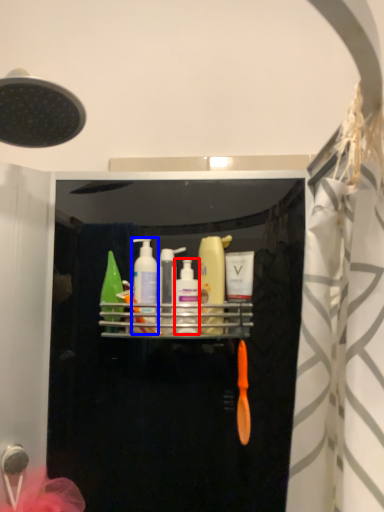
Question: Among these objects, which one is nearest to the camera, mouthwash (highlighted by a red box) or mouthwash (highlighted by a blue box)?

Choices:
 (A) mouthwash
 (B) mouthwash

Answer: (A)